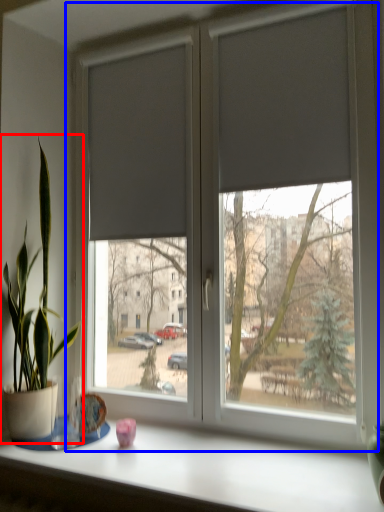
Question: Which point is further to the camera, houseplant (highlighted by a red box) or window (highlighted by a blue box)?

Choices:
 (A) houseplant
 (B) window

Answer: (A)